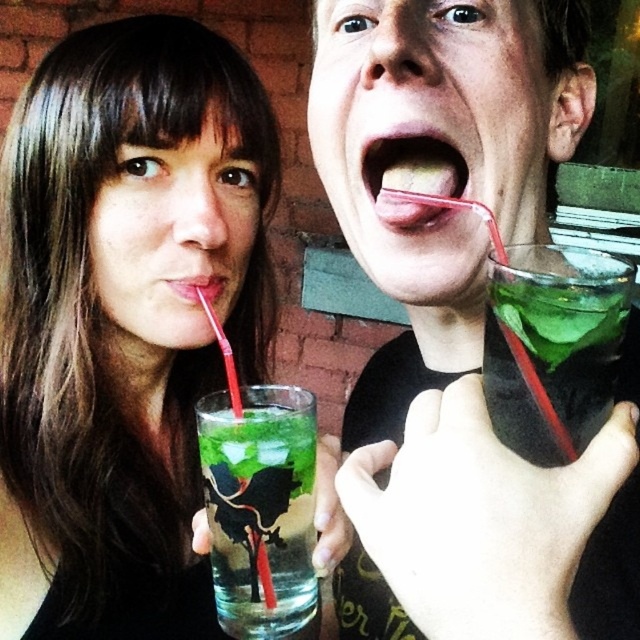
You are at a party and want to pour the green translucent liquid at right into the green translucent glass at mouth. Is the glass currently positioned in a way that allows pouring?

The green translucent glass at mouth is positioned over the green translucent liquid at right, so pouring would result in the liquid spilling over the glass unless the glass is moved to a lower position.

You are a photographer trying to capture a clear shot of the green translucent glass at center and the green translucent liquid at right. Which object should you focus on first to ensure both are in focus?

The green translucent glass at center is closer to the viewer than the green translucent liquid at right. To ensure both are in focus, focus on the green translucent glass at center first since it is closer, and the liquid at right will fall within the depth of field.

You are a photographer standing at the camera position. You want to capture a closeup shot of the green translucent liquid at right. Can you focus on it without adjusting your camera position?

The green translucent liquid at right and camera are 13.95 inches apart from each other, so yes, the photographer can focus on the green translucent liquid at right without needing to adjust the camera position since the distance is within typical focusing range.